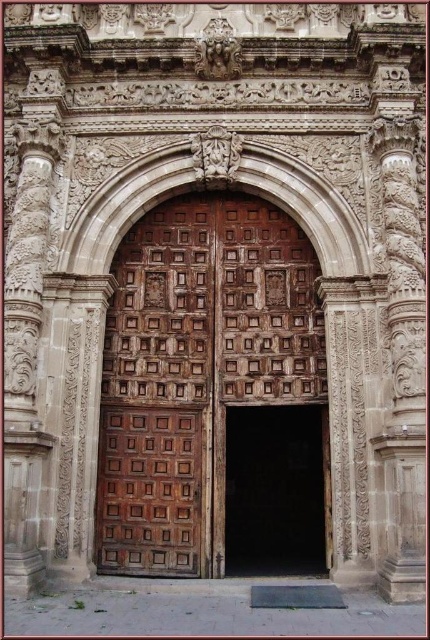
Question: Is wooden carved door at center above brown wood door at center?

Choices:
 (A) no
 (B) yes

Answer: (B)

Question: Can you confirm if wooden carved door at center is positioned to the left of brown wood door at center?

Choices:
 (A) yes
 (B) no

Answer: (A)

Question: Which object is closer to the camera taking this photo?

Choices:
 (A) wooden carved door at center
 (B) brown wood door at center

Answer: (A)

Question: Considering the relative positions of wooden carved door at center and brown wood door at center in the image provided, where is wooden carved door at center located with respect to brown wood door at center?

Choices:
 (A) below
 (B) above

Answer: (B)

Question: Among these objects, which one is nearest to the camera?

Choices:
 (A) brown wood door at center
 (B) wooden carved door at center

Answer: (B)